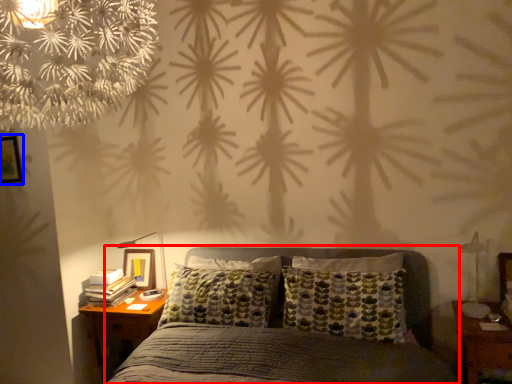
Question: Which of the following is the farthest to the observer, bed (highlighted by a red box) or picture frame (highlighted by a blue box)?

Choices:
 (A) bed
 (B) picture frame

Answer: (B)